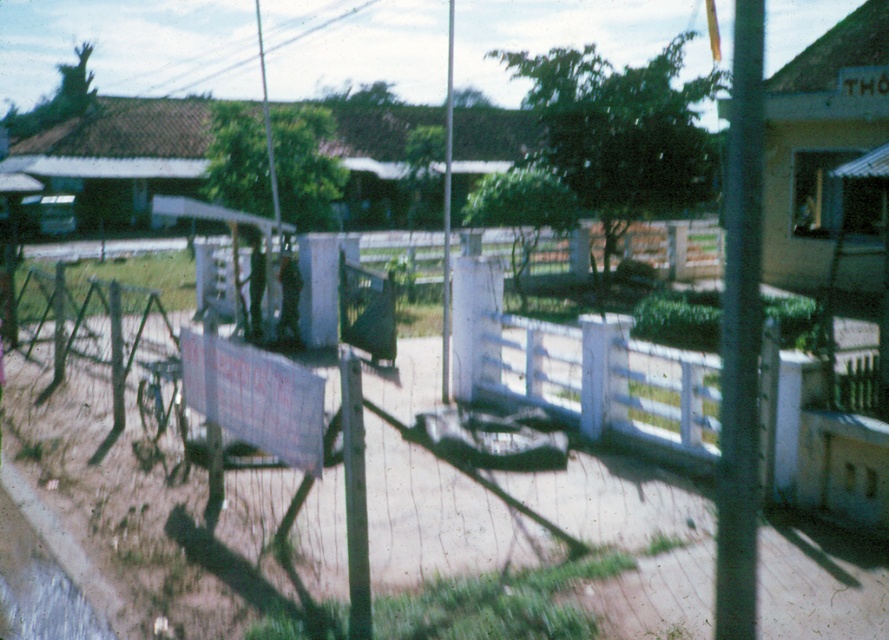
You are a delivery person trying to navigate through the area. You see the black metal pole at right and the white plastic fence at center. Which object is wider?

The black metal pole at right is wider than the white plastic fence at center according to the description.

You are a delivery person trying to navigate through the area. You see the black metal pole at right and the white plastic fence at center. Which object would block your path more if you were driving a delivery truck with a 2.5 meter width?

The black metal pole at right is larger in size than the white plastic fence at center, so it would block the path more for the delivery truck with a 2.5 meter width.